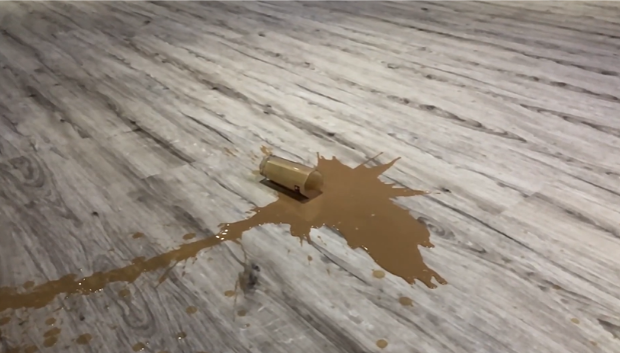
This screenshot has height=353, width=620. I want to click on inside cup, so click(310, 179).